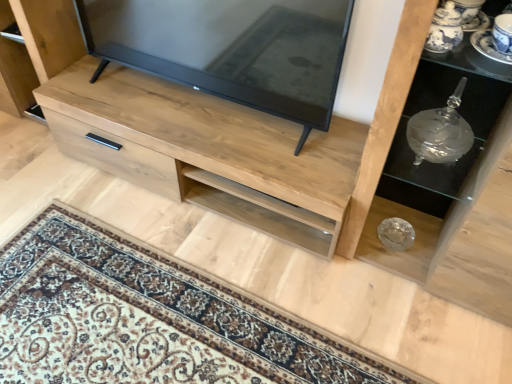
Question: Is matte black tv at center bigger or smaller than transparent glass vase at right, the 1th shelf viewed from the back?

Choices:
 (A) small
 (B) big

Answer: (B)

Question: From the image's perspective, is matte black tv at center above or below transparent glass vase at right, the second shelf in the front-to-back sequence?

Choices:
 (A) above
 (B) below

Answer: (A)

Question: Considering the real-world distances, which object is farthest from the transparent glass vase at right, the second shelf in the front-to-back sequence?

Choices:
 (A) blue and white porcelain saucer at upper right
 (B) matte black tv at center
 (C) natural wood chest of drawers at center
 (D) clear glass bowl at center, the 1th shelf when ordered from front to back

Answer: (B)

Question: Estimate the real-world distances between objects in this image. Which object is farther from the natural wood chest of drawers at center?

Choices:
 (A) matte black tv at center
 (B) clear glass bowl at center, which is counted as the second shelf, starting from the back
 (C) blue and white porcelain saucer at upper right
 (D) transparent glass vase at right, the 1th shelf viewed from the back

Answer: (C)